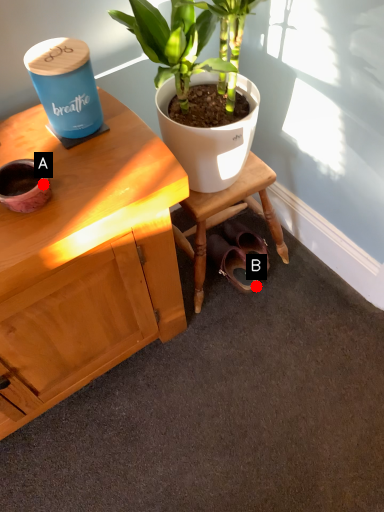
Question: Two points are circled on the image, labeled by A and B beside each circle. Which point is closer to the camera?

Choices:
 (A) A is closer
 (B) B is closer

Answer: (A)